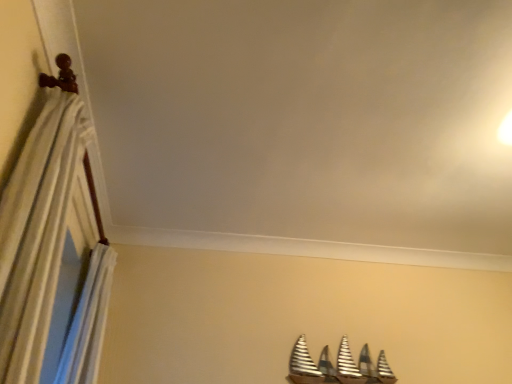
Question: Should I look upward or downward to see striped fabric curtain at left?

Choices:
 (A) up
 (B) down

Answer: (B)